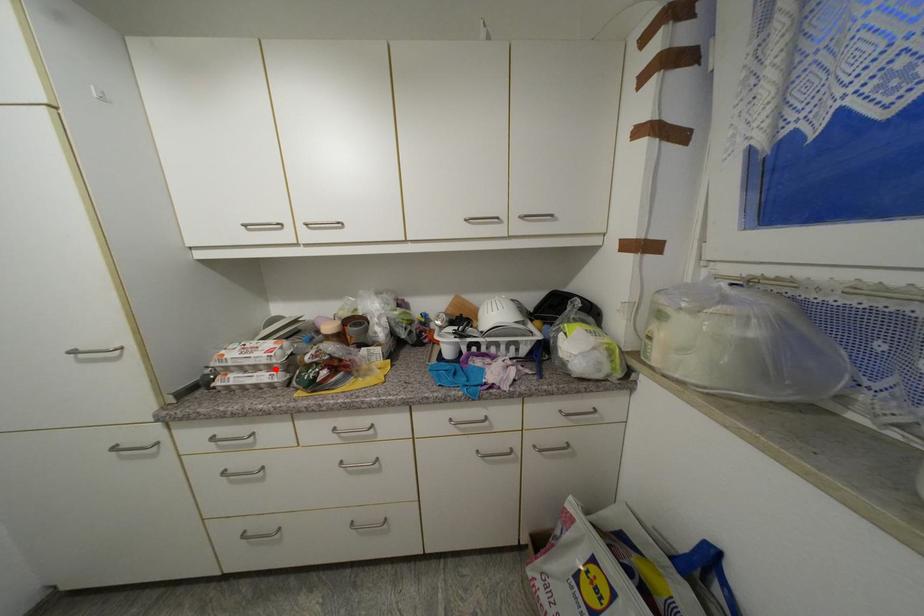
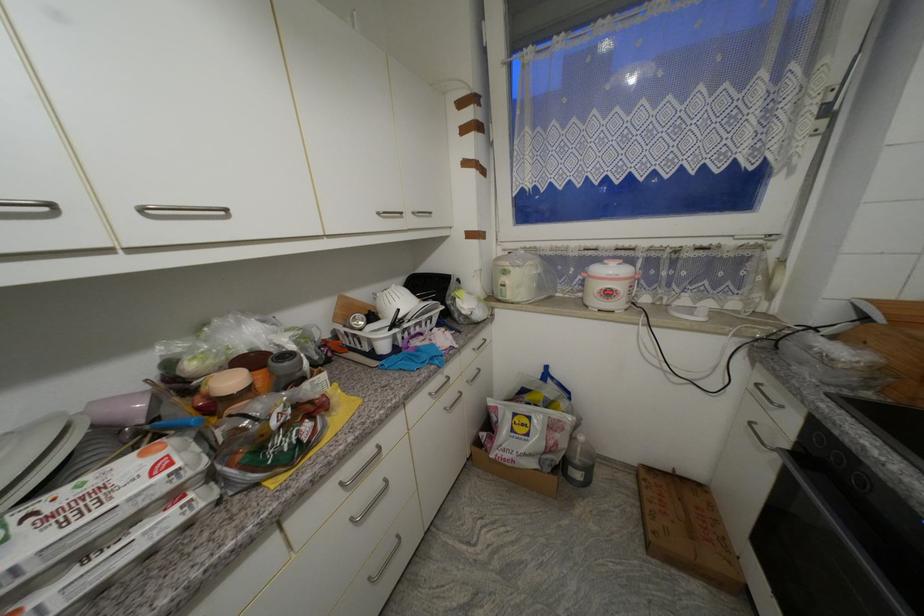
Question: I am providing you with two images of the same scene from different viewpoints. A red point is marked on the first image. At the location where the point appears in image 1, is it still visible in image 2?

Choices:
 (A) Yes
 (B) No

Answer: (A)